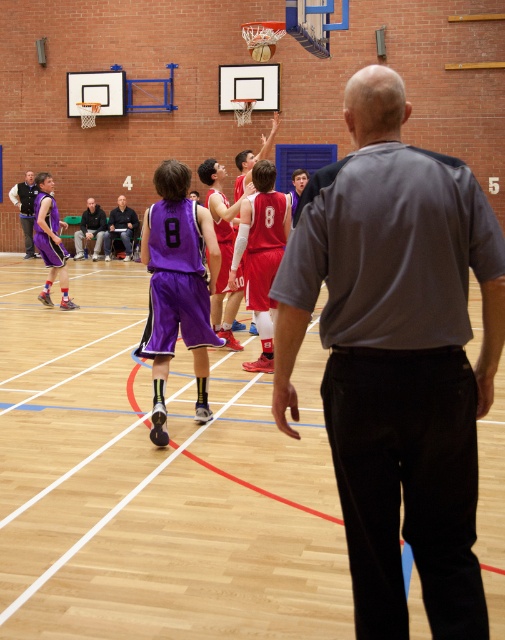
Who is positioned more to the right, matte black jacket at left or dark gray pants at center?

Positioned to the right is dark gray pants at center.

Is point (31, 211) closer to viewer compared to point (106, 221)?

That is True.

Find the location of `matte black jacket at left`. matte black jacket at left is located at coordinates (25, 209).

Who is taller, dark gray shirt at center or matte black jacket at left?

matte black jacket at left

Looking at this image, does dark gray shirt at center have a greater width compared to matte black jacket at left?

Result: No, dark gray shirt at center is not wider than matte black jacket at left.

Between point (125, 232) and point (26, 198), which one is positioned in front?

Positioned in front is point (125, 232).

Find the location of a particular element. This screenshot has width=505, height=640. dark gray shirt at center is located at coordinates (121, 227).

Between gray smooth shirt at center and matte black jacket at left, which one has less height?

Standing shorter between the two is gray smooth shirt at center.

Does gray smooth shirt at center have a lesser height compared to matte black jacket at left?

Yes.

Who is more distant from viewer, (396, 125) or (29, 237)?

Point (29, 237)

The width and height of the screenshot is (505, 640). I want to click on gray smooth shirt at center, so click(x=397, y=358).